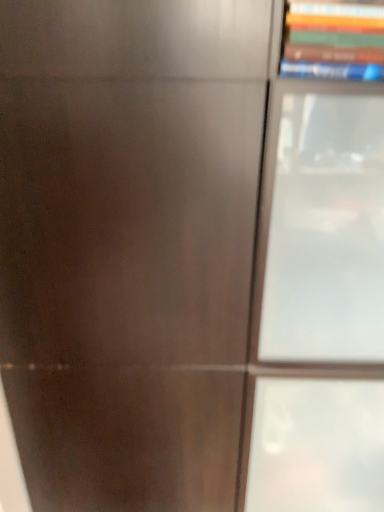
What is the approximate height of hardcover book at upper right?

hardcover book at upper right is 6.12 inches tall.

Find the location of `hardcover book at upper right`. hardcover book at upper right is located at coordinates (333, 40).

Describe the element at coordinates (333, 40) in the screenshot. I see `hardcover book at upper right` at that location.

Identify the location of hardcover book at upper right. (333, 40).